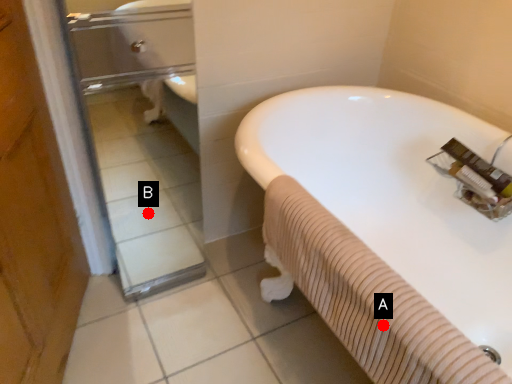
Question: Two points are circled on the image, labeled by A and B beside each circle. Which point is further to the camera?

Choices:
 (A) A is further
 (B) B is further

Answer: (B)